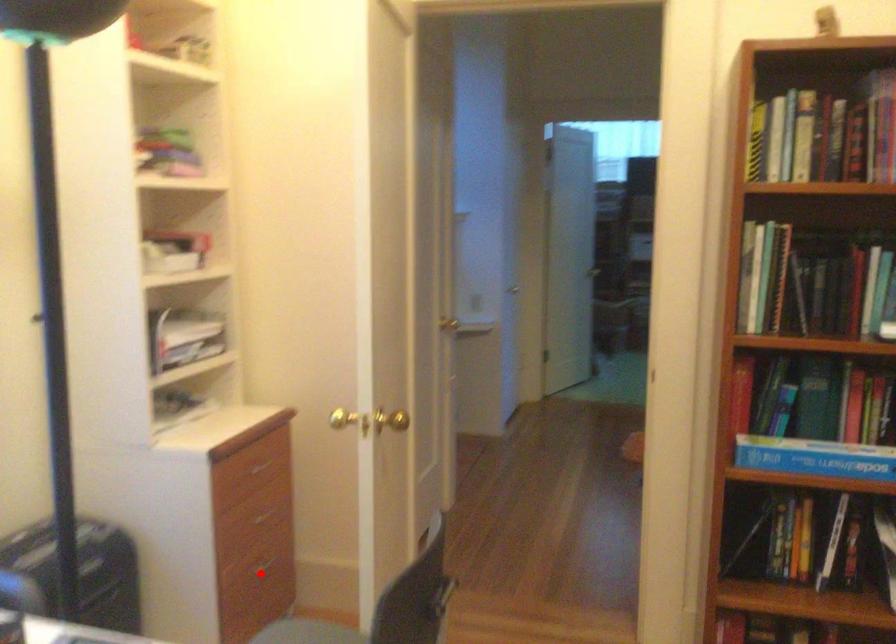
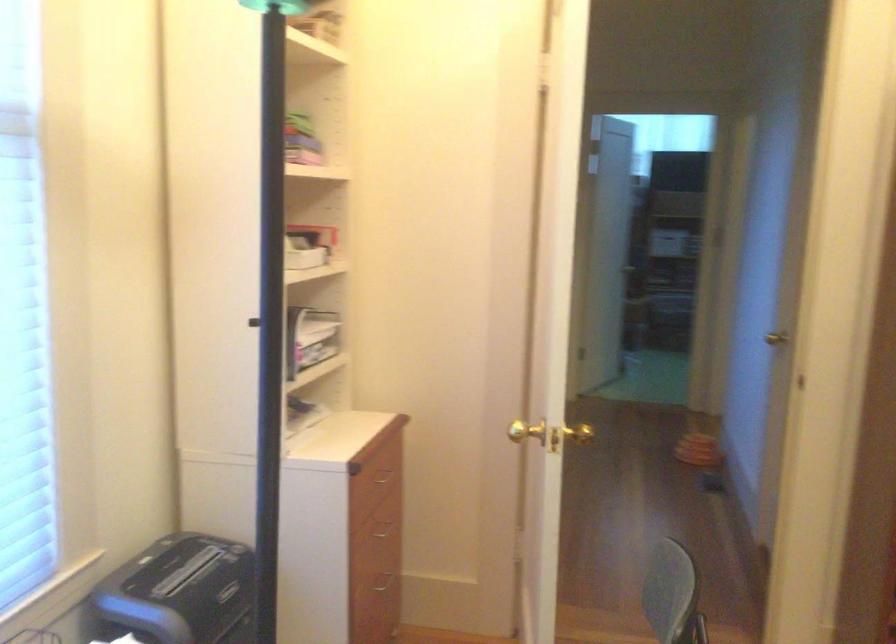
Where in the second image is the point corresponding to the highlighted location from the first image?

(382, 587)